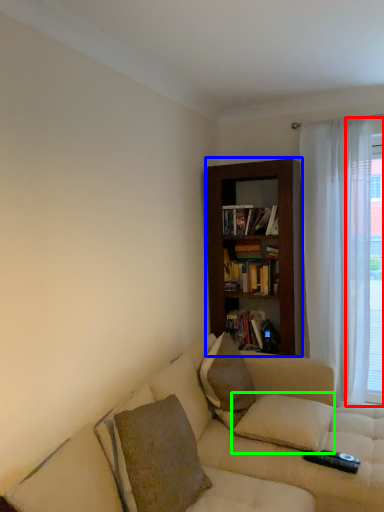
Question: Which object is the closest to the window frame (highlighted by a red box)? Choose among these: bookcase (highlighted by a blue box) or pillow (highlighted by a green box).

Choices:
 (A) bookcase
 (B) pillow

Answer: (A)